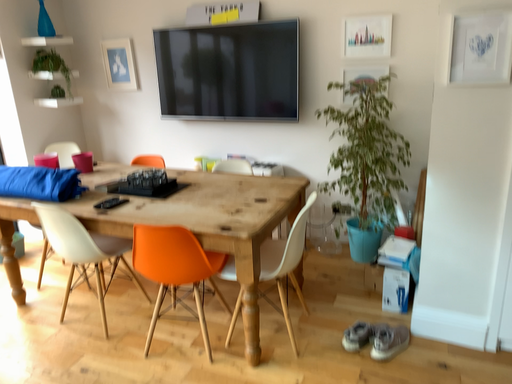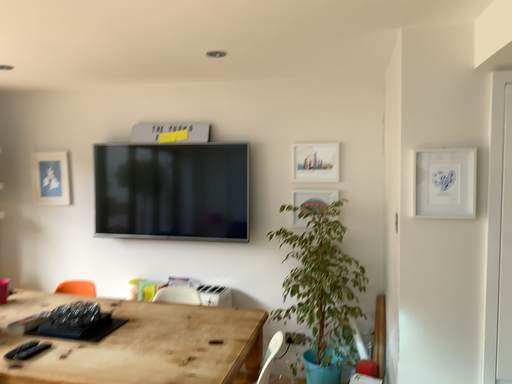
Question: Which way did the camera rotate in the video?

Choices:
 (A) rotated left
 (B) rotated right

Answer: (B)